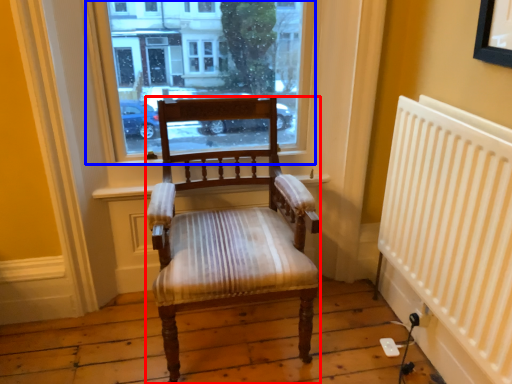
Question: Which object appears closest to the camera in this image, chair (highlighted by a red box) or window (highlighted by a blue box)?

Choices:
 (A) chair
 (B) window

Answer: (A)